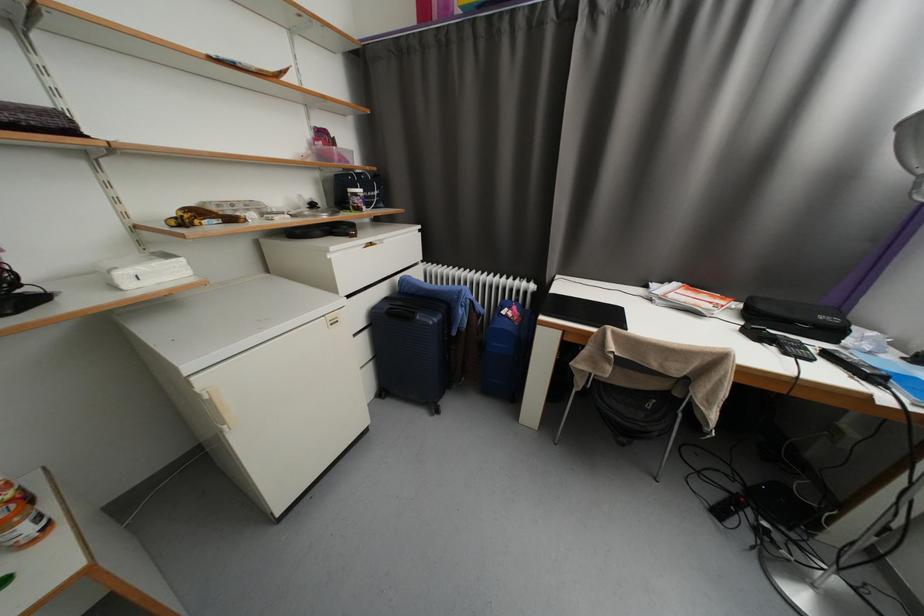
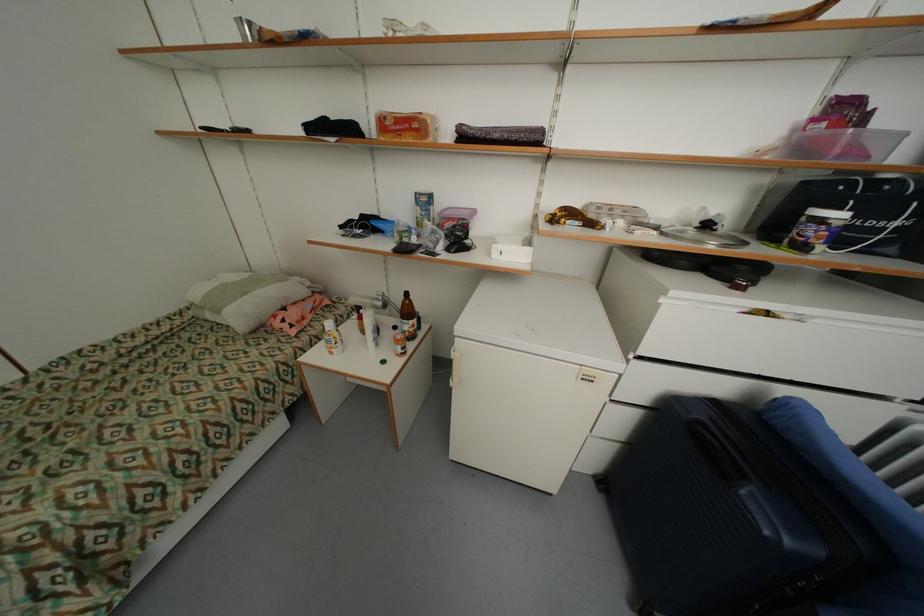
Based on the continuous images, in which direction is the camera rotating?

The camera rotated toward left-down.